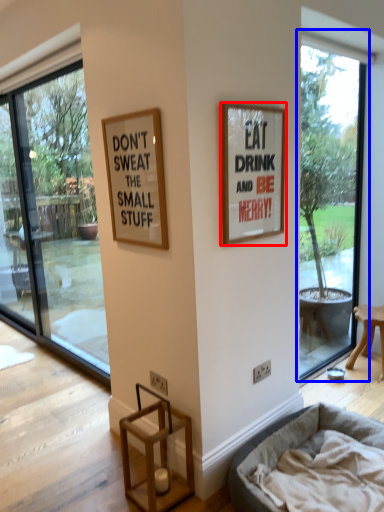
Question: Which of the following is the farthest to the observer, picture frame (highlighted by a red box) or window (highlighted by a blue box)?

Choices:
 (A) picture frame
 (B) window

Answer: (B)